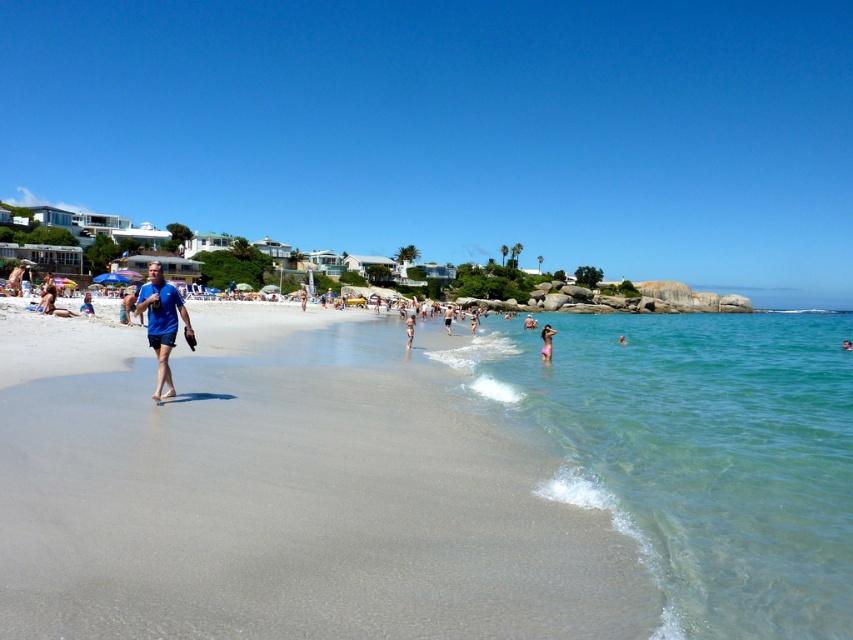
Question: Does clear water at beach right appear on the right side of matte blue shorts at lower left?

Choices:
 (A) no
 (B) yes

Answer: (B)

Question: Is clear water at beach right positioned behind blue fabric person at center?

Choices:
 (A) no
 (B) yes

Answer: (A)

Question: Where is gray sand at center located in relation to blue fabric shirt at left in the image?

Choices:
 (A) left
 (B) right

Answer: (B)

Question: Estimate the real-world distances between objects in this image. Which object is closer to the pink fabric at center?

Choices:
 (A) clear water at beach right
 (B) white sand beach at lower left
 (C) blue fabric shirt at left
 (D) smooth skin person at center

Answer: (C)

Question: Which object is positioned farthest from the matte blue shorts at lower left?

Choices:
 (A) white sand beach at lower left
 (B) blue matte shorts at left
 (C) blue fabric shirt at left
 (D) smooth skin person at center

Answer: (A)

Question: Among these points, which one is nearest to the camera?

Choices:
 (A) (42, 308)
 (B) (846, 346)

Answer: (A)